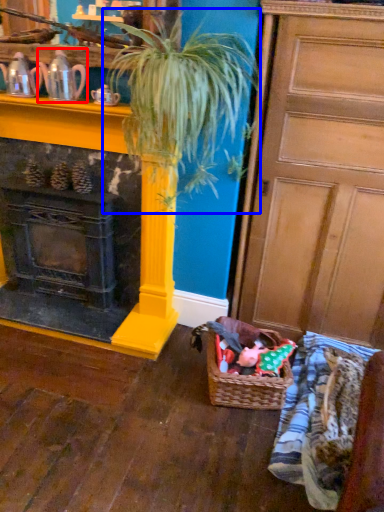
Question: Which of the following is the farthest to the observer, tea pot (highlighted by a red box) or houseplant (highlighted by a blue box)?

Choices:
 (A) tea pot
 (B) houseplant

Answer: (A)